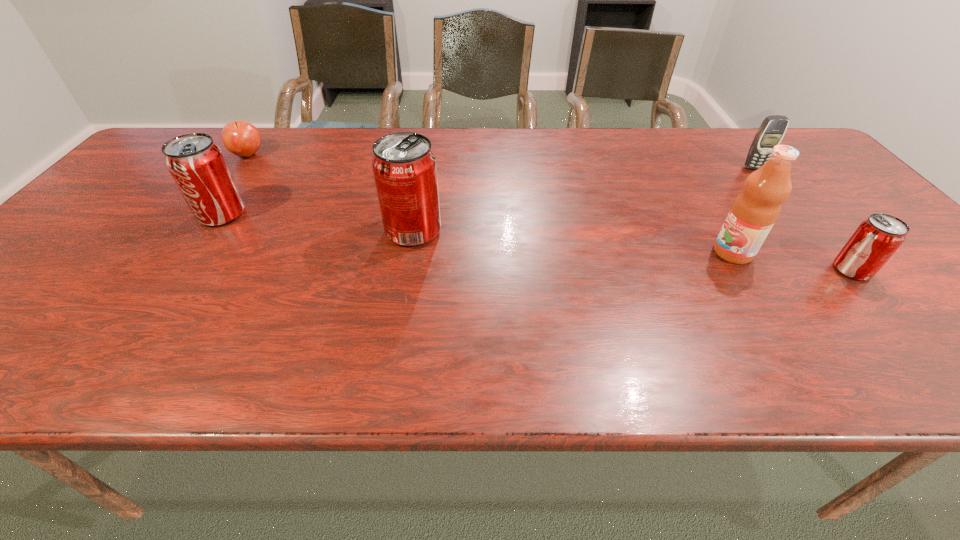
At what (x,y) coordinates should I click in order to perform the action: click on free area in between the rightmost pop soda and the shortest object. Please return your answer as a coordinate pair (x, y). The height and width of the screenshot is (540, 960). Looking at the image, I should click on (550, 212).

Where is `vacant space in between the third object from right to left and the third tallest object`? vacant space in between the third object from right to left and the third tallest object is located at coordinates (477, 233).

Identify the location of vacant region between the leftmost pop soda and the nearest pop soda. (537, 242).

You are a GUI agent. You are given a task and a screenshot of the screen. Output one action in this format:
    pyautogui.click(x=<x>, y=<y>)
    Task: Click on the free point between the nearest pop soda and the fourth object from left to right
    This screenshot has height=540, width=960.
    Given the screenshot: What is the action you would take?
    pyautogui.click(x=792, y=261)

This screenshot has width=960, height=540. In order to click on vacant area between the second pop soda from right to left and the fruit juice in this screenshot , I will do `click(573, 242)`.

You are a GUI agent. You are given a task and a screenshot of the screen. Output one action in this format:
    pyautogui.click(x=<x>, y=<y>)
    Task: Click on the closest object relative to the shortest object
    
    Given the screenshot: What is the action you would take?
    pyautogui.click(x=197, y=165)

Select which object appears as the fifth closest to the cellular telephone. Please provide its 2D coordinates. Your answer should be formatted as a tuple, i.e. [(x, y)], where the tuple contains the x and y coordinates of a point satisfying the conditions above.

[(241, 138)]

Choose which pop soda is the nearest neighbor to the second farthest object. Please provide its 2D coordinates. Your answer should be formatted as a tuple, i.e. [(x, y)], where the tuple contains the x and y coordinates of a point satisfying the conditions above.

[(877, 238)]

Identify the location of pop soda that is the closest one to the rightmost pop soda. tap(404, 167).

I want to click on blank space that satisfies the following two spatial constraints: 1. on the front label of the fifth tallest object; 2. on the right side of the third object from right to left, so click(x=743, y=270).